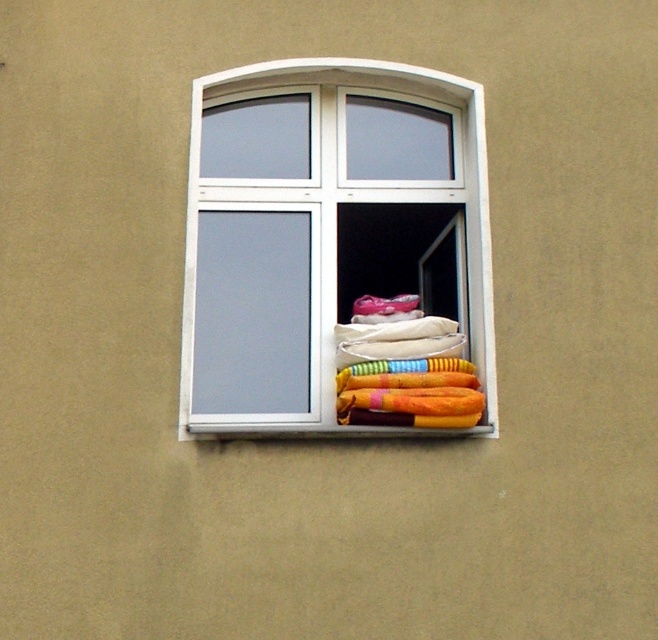
Question: Which object appears closest to the camera in this image?

Choices:
 (A) white plastic window at center
 (B) multicolored fabric at center

Answer: (A)

Question: Does white plastic window at center appear on the left side of multicolored fabric at center?

Choices:
 (A) no
 (B) yes

Answer: (B)

Question: In this image, where is white plastic window at center located relative to multicolored fabric at center?

Choices:
 (A) below
 (B) above

Answer: (B)

Question: Which point appears closest to the camera in this image?

Choices:
 (A) (411, 408)
 (B) (488, 298)

Answer: (A)

Question: Can you confirm if white plastic window at center is bigger than multicolored fabric at center?

Choices:
 (A) no
 (B) yes

Answer: (B)